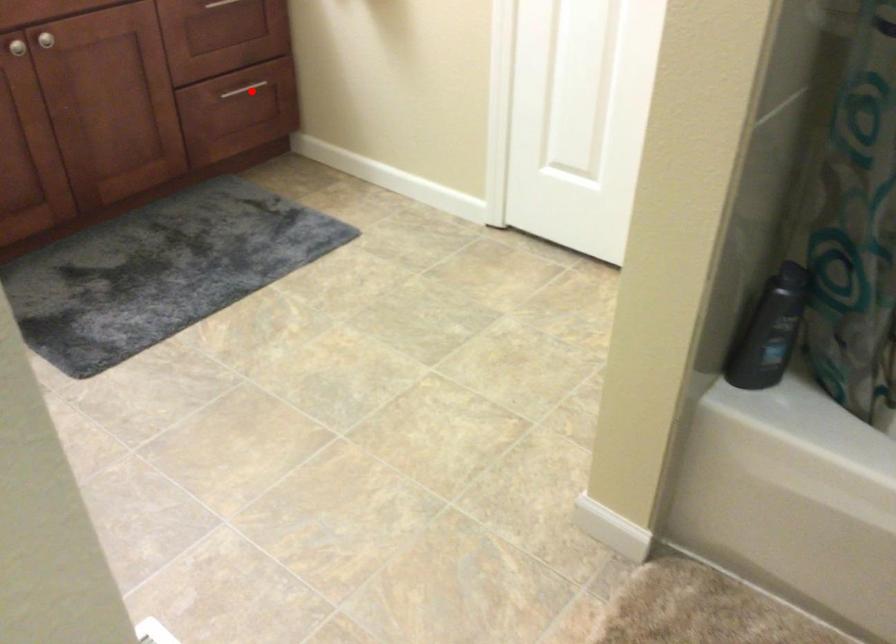
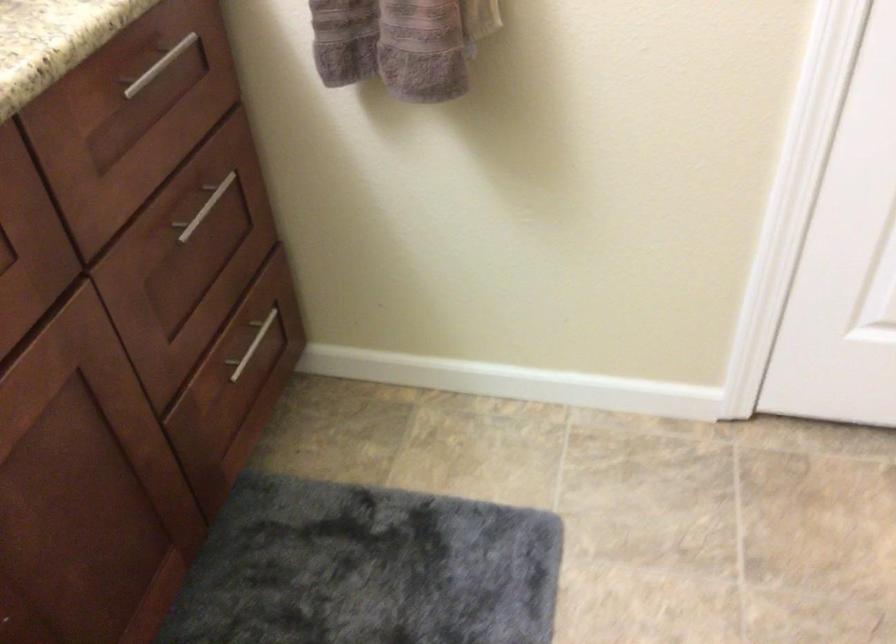
Question: I am providing you with two images of the same scene from different viewpoints. A red point is marked on the first image. Can you still see the location of the red point in image 2?

Choices:
 (A) Yes
 (B) No

Answer: (A)